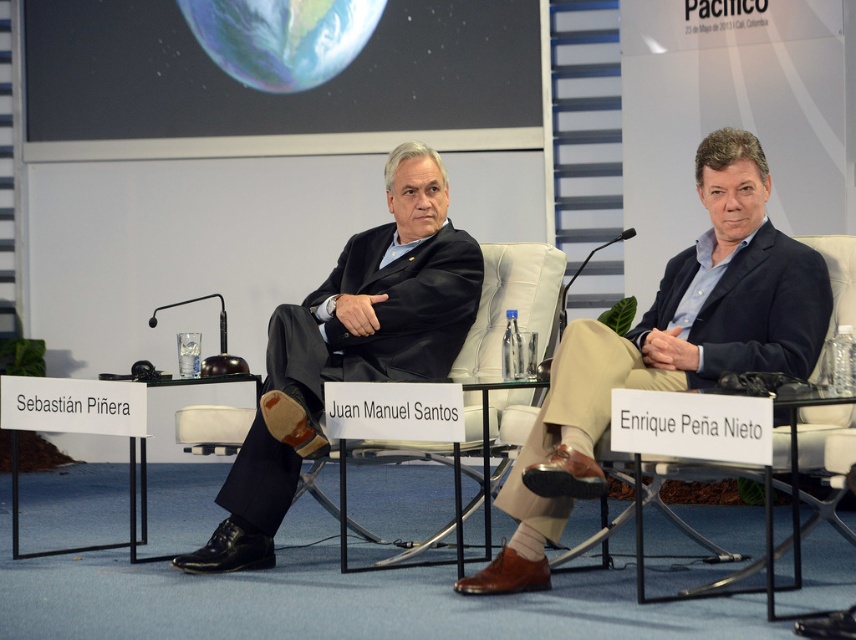
This screenshot has height=640, width=856. In order to click on matte black suit at center in this screenshot , I will do `click(666, 349)`.

Is point (676, 291) positioned behind point (272, 496)?

No, (676, 291) is closer to viewer.

I want to click on matte black suit at center, so click(x=666, y=349).